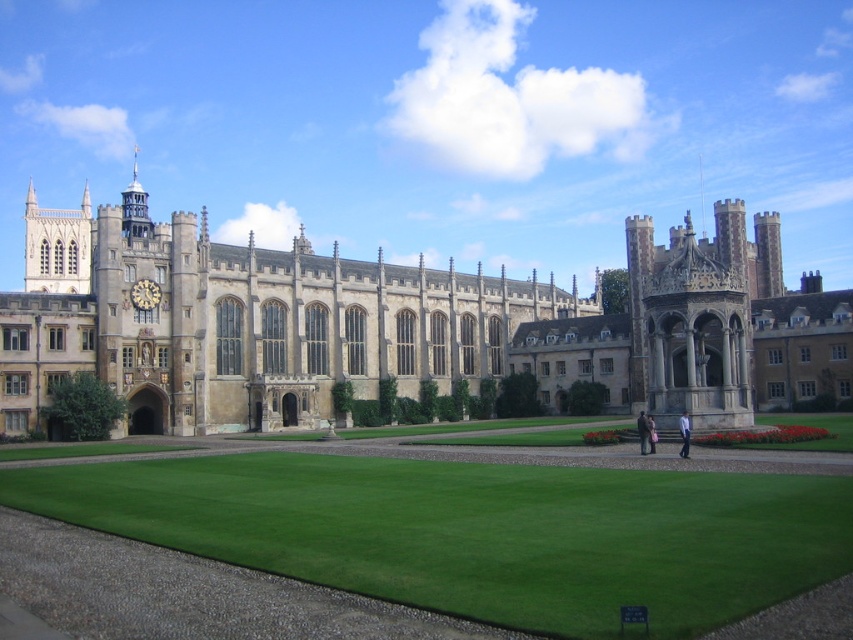
Question: Which point appears farthest from the camera in this image?

Choices:
 (A) (138, 296)
 (B) (322, 524)

Answer: (A)

Question: Is the position of stone building at center more distant than that of green lawn at center?

Choices:
 (A) no
 (B) yes

Answer: (B)

Question: Can you confirm if stone building at center is positioned to the left of green lawn at center?

Choices:
 (A) no
 (B) yes

Answer: (A)

Question: Which point is farther from the camera taking this photo?

Choices:
 (A) (392, 512)
 (B) (137, 292)
 (C) (296, 317)

Answer: (C)

Question: Is green lawn at center smaller than gold metallic clock at upper left?

Choices:
 (A) no
 (B) yes

Answer: (A)

Question: Estimate the real-world distances between objects in this image. Which object is closer to the gold metallic clock at upper left?

Choices:
 (A) stone building at center
 (B) green lawn at center

Answer: (A)